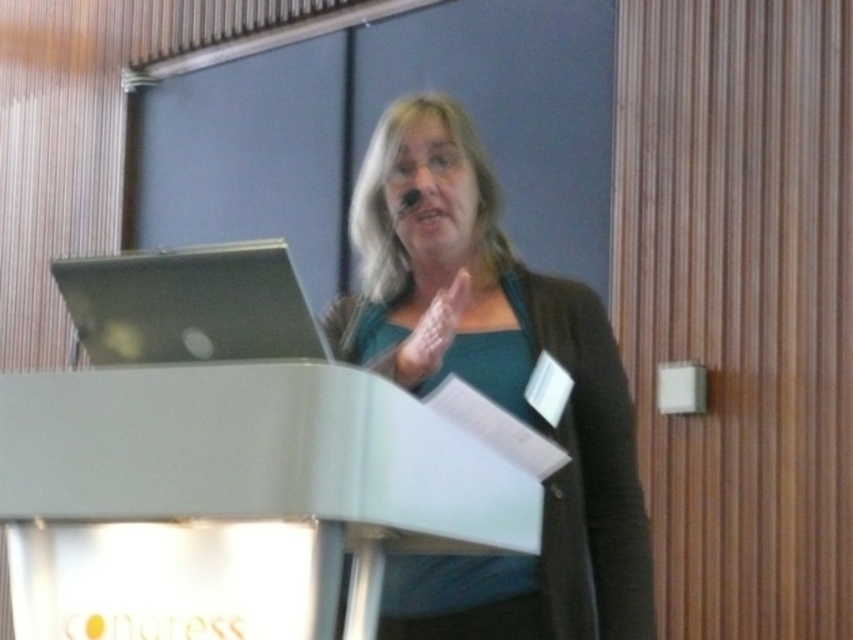
Question: Based on their relative distances, which object is farther from the teal fabric shirt at center?

Choices:
 (A) silver metallic laptop at left
 (B) white plastic podium at center

Answer: (A)

Question: Among these objects, which one is farthest from the camera?

Choices:
 (A) teal fabric shirt at center
 (B) silver metallic laptop at left
 (C) white plastic podium at center

Answer: (A)

Question: Considering the relative positions of teal fabric shirt at center and white plastic podium at center in the image provided, where is teal fabric shirt at center located with respect to white plastic podium at center?

Choices:
 (A) right
 (B) left

Answer: (A)

Question: Is teal fabric shirt at center smaller than white plastic podium at center?

Choices:
 (A) yes
 (B) no

Answer: (B)

Question: Can you confirm if teal fabric shirt at center is bigger than silver metallic laptop at left?

Choices:
 (A) yes
 (B) no

Answer: (A)

Question: Among these objects, which one is farthest from the camera?

Choices:
 (A) teal fabric shirt at center
 (B) white plastic podium at center

Answer: (A)